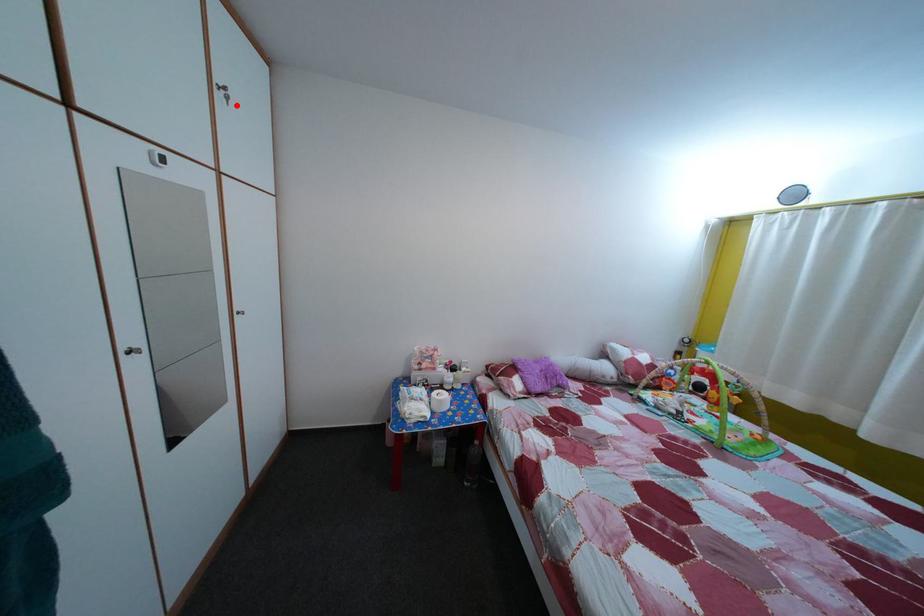
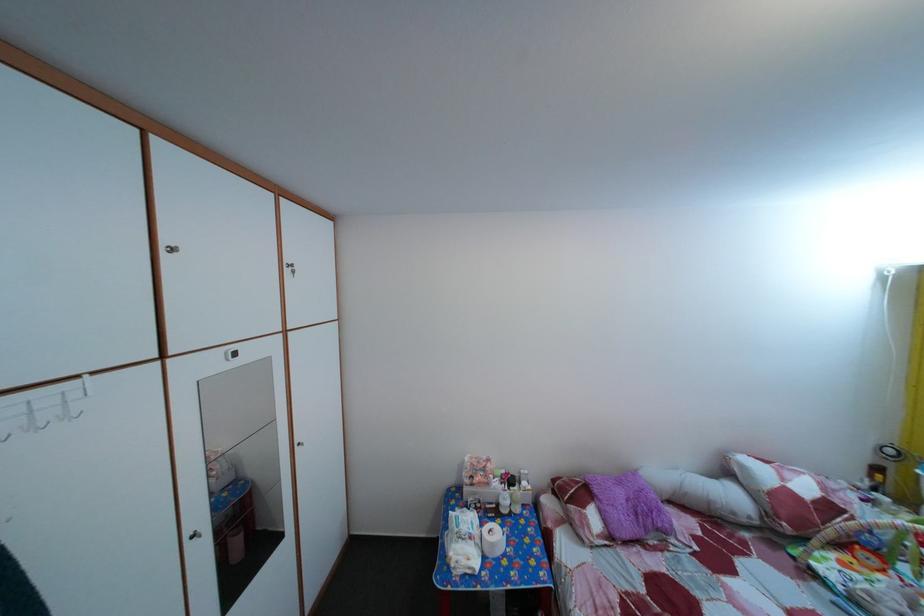
Where in the second image is the point corresponding to the highlighted location from the first image?

(304, 280)